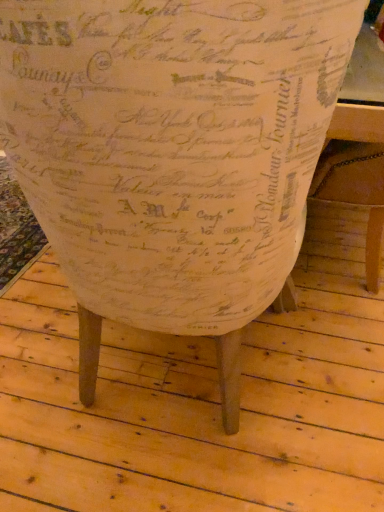
Question: Should I look upward or downward to see white paper flowerpot at center?

Choices:
 (A) up
 (B) down

Answer: (A)